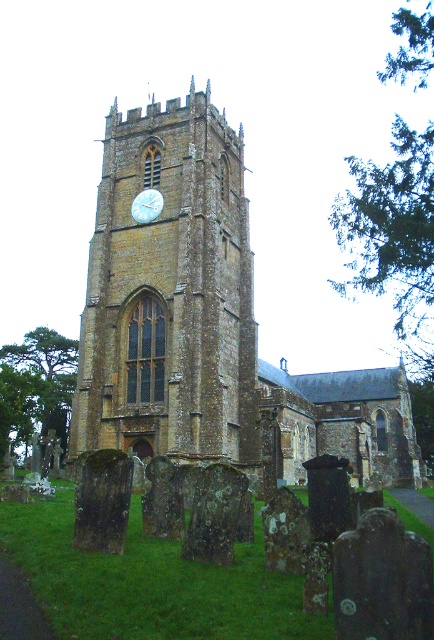
Consider the image. Can you confirm if brown stone clock tower at center is shorter than white glossy clock at upper center?

In fact, brown stone clock tower at center may be taller than white glossy clock at upper center.

Who is taller, brown stone clock tower at center or white glossy clock at upper center?

Standing taller between the two is brown stone clock tower at center.

Which is in front, point (163, 177) or point (141, 196)?

Point (163, 177) is in front.

What are the coordinates of `brown stone clock tower at center` in the screenshot? It's located at (170, 292).